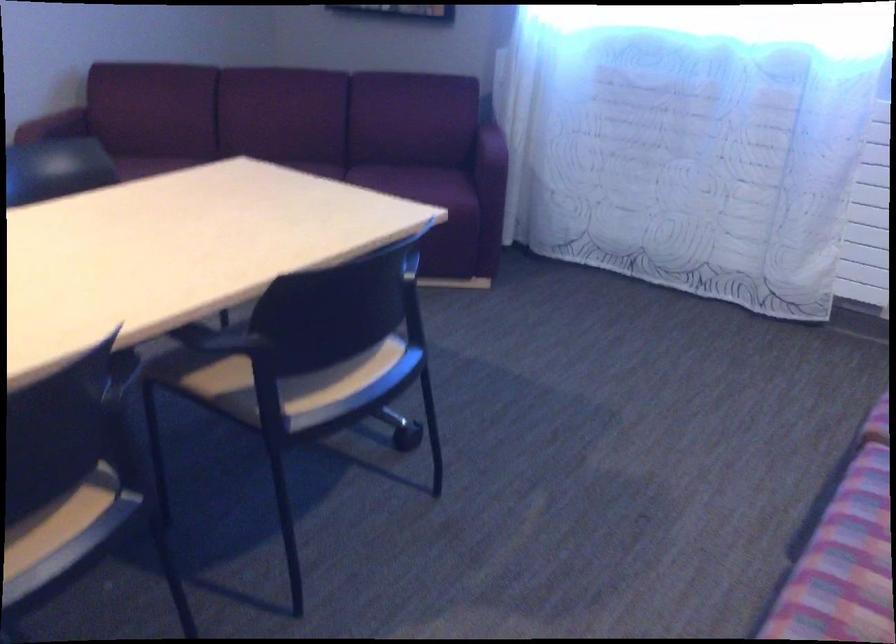
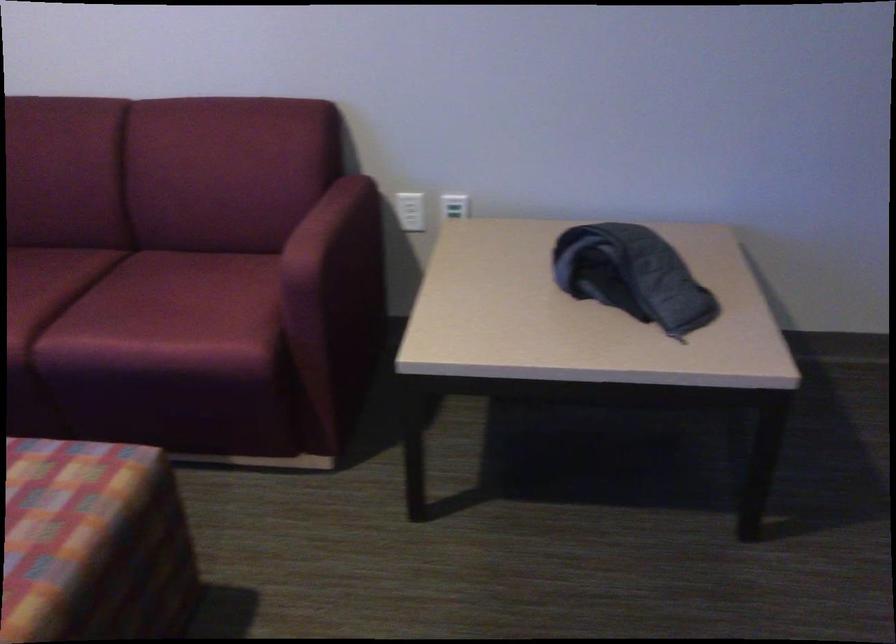
First-person continuous shooting, in which direction is the camera rotating?

The camera's rotation is toward right-down.